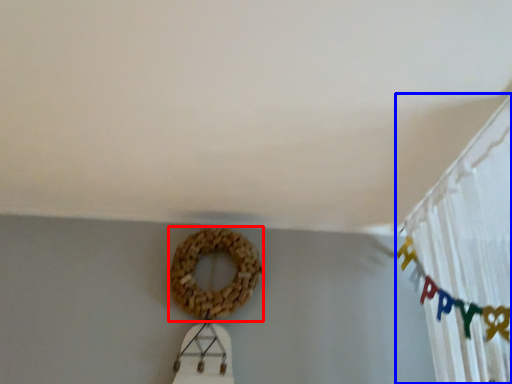
Question: Which point is closer to the camera, bagel (highlighted by a red box) or curtain (highlighted by a blue box)?

Choices:
 (A) bagel
 (B) curtain

Answer: (B)